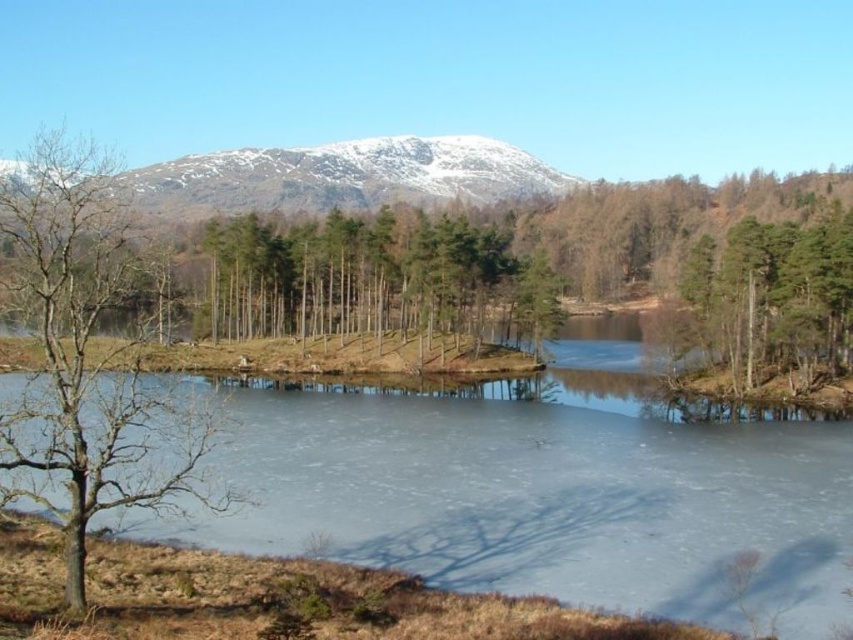
Question: Is bare wood tree at left above brown textured tree at right?

Choices:
 (A) yes
 (B) no

Answer: (A)

Question: Which is nearer to the brown textured tree at right?

Choices:
 (A) bare wood tree at left
 (B) frozen ice at center

Answer: (B)

Question: Where is bare wood tree at left located in relation to brown textured tree at right in the image?

Choices:
 (A) above
 (B) below

Answer: (A)

Question: Which point is farther from the camera taking this photo?

Choices:
 (A) coord(436,579)
 (B) coord(91,180)
 (C) coord(775,365)

Answer: (C)

Question: Can you confirm if frozen ice at center is positioned to the right of brown textured tree at right?

Choices:
 (A) yes
 (B) no

Answer: (B)

Question: Which of the following is the farthest from the observer?

Choices:
 (A) (469, 470)
 (B) (705, 269)
 (C) (86, 333)

Answer: (B)